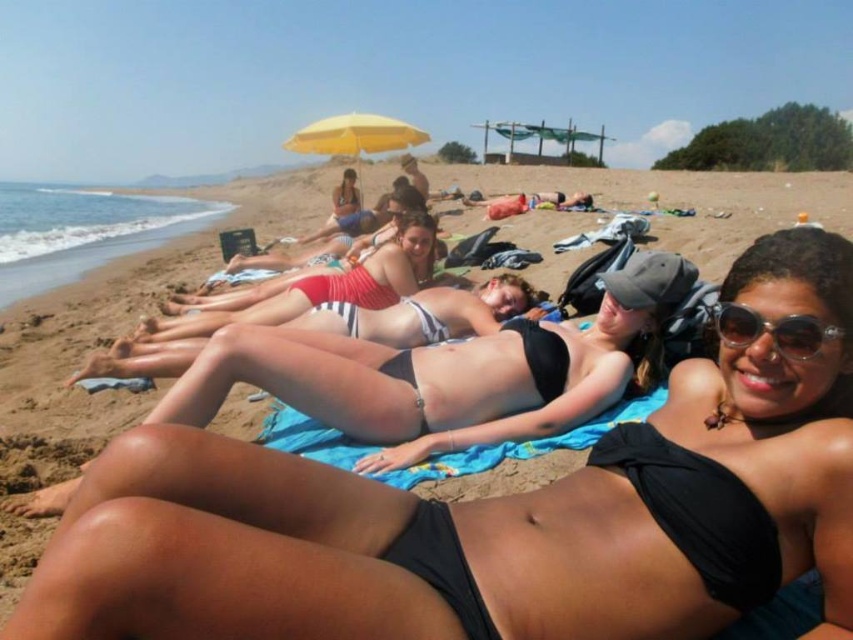
You are a photographer taking a picture of the beach scene. You notice the black matte bikini at center and the sunglasses at center. Based on their positions, which object is closer to the camera?

The black matte bikini at center is below sunglasses at center, so the sunglasses at center is closer to the camera because objects higher up in the image are typically nearer.

You are a photographer trying to capture the black matte bikini top at lower center and the sunglasses at center in the same frame. Which object should you focus on first if you want to ensure both are in focus without adjusting your camera settings?

The black matte bikini top at lower center is taller than the sunglasses at center, so focusing on the taller object first would help ensure both are in focus since it is further away.